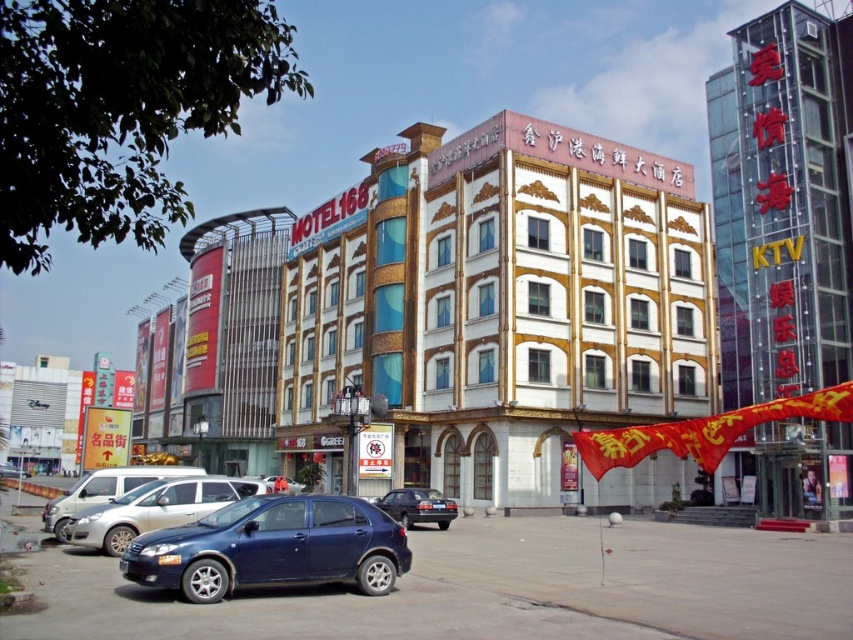
You are a photographer standing at the lower left corner of the scene. You want to take a photo of the white glossy building at center and the satin blue hatchback at lower left. Which object should you focus on first if you want to capture both in the frame without moving the camera?

The white glossy building at center is much taller than the satin blue hatchback at lower left. Since the building is taller, you should focus on it first to ensure it fits in the frame, then adjust to include the hatchback.

You are standing at the point closest to the buildings in this urban scene. There are two points marked in the image. One is at point coordinates point (506, 216) and the other is at point coordinates point (358, 515). Which point is farther away from you?

Point (506, 216) is behind point (358, 515), so it is farther away from you.

Consider the image. You are a delivery driver trying to park your vehicle in this area. You have a van that is 2 meters wide. There is a metallic silver sedan at lower left and a dark blue metallic car at center. Can your van fit between them?

The metallic silver sedan at lower left is closer to the viewer than dark blue metallic car at center. Therefore, the distance between them is not specified, so it is uncertain whether the van can fit between them.